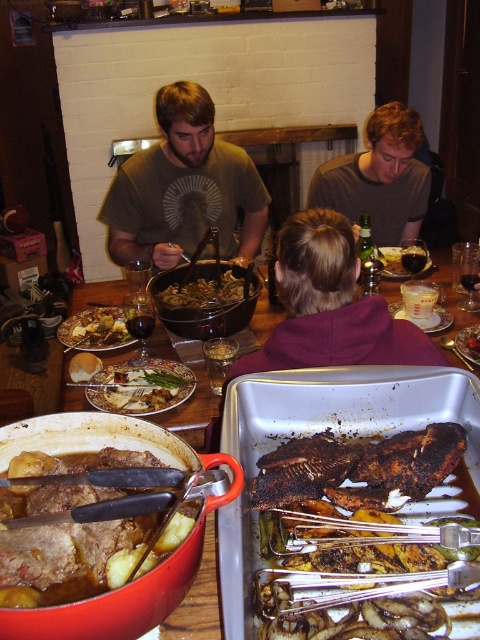
Question: Which point is closer to the camera?

Choices:
 (A) (121, 344)
 (B) (436, 536)
 (C) (423, 209)

Answer: (B)

Question: Can you confirm if matte brown shirt at center is wider than dark brown crispy meat at center?

Choices:
 (A) yes
 (B) no

Answer: (A)

Question: Estimate the real-world distances between objects in this image. Which object is closer to the charred wooden fish at center?

Choices:
 (A) meaty brown stew at center
 (B) purple fleece at center
 (C) matte black tray at center
 (D) dark brown crispy meat at center

Answer: (C)

Question: Which point appears closest to the camera in this image?

Choices:
 (A) (110, 493)
 (B) (196, 296)
 (C) (427, 349)

Answer: (A)

Question: Observing the image, what is the correct spatial positioning of matte black tray at center in reference to golden brown mashed potatoes at center?

Choices:
 (A) above
 (B) below

Answer: (B)

Question: Does purple fleece at center have a smaller size compared to matte gray shirt at upper center?

Choices:
 (A) yes
 (B) no

Answer: (B)